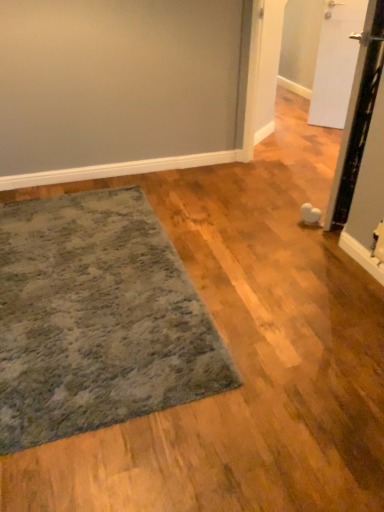
At what (x,y) coordinates should I click in order to perform the action: click on white matte door at upper right, placed as the 2th door when sorted from front to back. Please return your answer as a coordinate pair (x, y). This screenshot has height=512, width=384. Looking at the image, I should click on (336, 62).

Locate an element on the screen. This screenshot has height=512, width=384. white glossy door at right, acting as the first door starting from the front is located at coordinates (357, 116).

Would you say white glossy door at right, acting as the first door starting from the front, contains white matte door at upper right, acting as the first door starting from the back?

No, white matte door at upper right, acting as the first door starting from the back, is not inside white glossy door at right, acting as the first door starting from the front.

Which is closer to the camera, (351, 166) or (338, 31)?

Point (351, 166).

Considering the positions of objects white glossy door at right, the second door from the back, and white matte door at upper right, placed as the 2th door when sorted from front to back, in the image provided, who is more to the left, white glossy door at right, the second door from the back, or white matte door at upper right, placed as the 2th door when sorted from front to back,?

white glossy door at right, the second door from the back, is more to the left.

Which of these two, white glossy door at right, the second door from the back, or white matte door at upper right, placed as the 2th door when sorted from front to back, stands taller?

With more height is white glossy door at right, the second door from the back.

How many degrees apart are the facing directions of textured gray rug at lower left and white glossy door at right, the second door from the back?

133 degrees.

Considering the relative sizes of textured gray rug at lower left and white glossy door at right, the second door from the back, in the image provided, is textured gray rug at lower left thinner than white glossy door at right, the second door from the back,?

No, textured gray rug at lower left is not thinner than white glossy door at right, the second door from the back.

In the image, is textured gray rug at lower left on the left side or the right side of white glossy door at right, the second door from the back?

In the image, textured gray rug at lower left appears on the left side of white glossy door at right, the second door from the back.

At what (x,y) coordinates should I click in order to perform the action: click on the 2nd door located above the textured gray rug at lower left (from a real-world perspective). Please return your answer as a coordinate pair (x, y). This screenshot has height=512, width=384. Looking at the image, I should click on (357, 116).

Is there a large distance between textured gray rug at lower left and white matte door at upper right, placed as the 2th door when sorted from front to back?

textured gray rug at lower left is positioned a significant distance from white matte door at upper right, placed as the 2th door when sorted from front to back.

Can you tell me how much textured gray rug at lower left and white matte door at upper right, placed as the 2th door when sorted from front to back, differ in facing direction?

textured gray rug at lower left and white matte door at upper right, placed as the 2th door when sorted from front to back, are facing 43.9 degrees away from each other.

Who is bigger, textured gray rug at lower left or white matte door at upper right, placed as the 2th door when sorted from front to back?

Bigger between the two is textured gray rug at lower left.

Which point is more distant from viewer, [11,368] or [351,41]?

Point [351,41]

Is white matte door at upper right, placed as the 2th door when sorted from front to back, wider than textured gray rug at lower left?

Incorrect, the width of white matte door at upper right, placed as the 2th door when sorted from front to back, does not surpass that of textured gray rug at lower left.

From the picture: Is there a large distance between white matte door at upper right, acting as the first door starting from the back, and textured gray rug at lower left?

Yes, white matte door at upper right, acting as the first door starting from the back, and textured gray rug at lower left are located far from each other.

Measure the distance between white matte door at upper right, acting as the first door starting from the back, and textured gray rug at lower left.

white matte door at upper right, acting as the first door starting from the back, and textured gray rug at lower left are 8.79 feet apart from each other.

Based on the photo, which is more to the right, white matte door at upper right, placed as the 2th door when sorted from front to back, or textured gray rug at lower left?

white matte door at upper right, placed as the 2th door when sorted from front to back, is more to the right.

In the scene shown: Is white glossy door at right, acting as the first door starting from the front, bigger than textured gray rug at lower left?

No.

Is white glossy door at right, acting as the first door starting from the front, aimed at textured gray rug at lower left?

No.

Does white glossy door at right, the second door from the back, have a lesser height compared to textured gray rug at lower left?

In fact, white glossy door at right, the second door from the back, may be taller than textured gray rug at lower left.

Is white matte door at upper right, placed as the 2th door when sorted from front to back, at the left side of white glossy door at right, acting as the first door starting from the front?

No.

Which is correct: white matte door at upper right, placed as the 2th door when sorted from front to back, is inside white glossy door at right, acting as the first door starting from the front, or outside of it?

The correct answer is: outside.

Which is in front, point (335, 56) or point (337, 187)?

The point (337, 187) is in front.

The height and width of the screenshot is (512, 384). What are the coordinates of `door above the white glossy door at right, acting as the first door starting from the front (from the image's perspective)` in the screenshot? It's located at (336, 62).

From a real-world perspective, count 2nd doors upward from the textured gray rug at lower left and point to it. Please provide its 2D coordinates.

[(357, 116)]

Estimate the real-world distances between objects in this image. Which object is further from textured gray rug at lower left, white matte door at upper right, acting as the first door starting from the back, or white glossy door at right, acting as the first door starting from the front?

white matte door at upper right, acting as the first door starting from the back.

When comparing their distances from white matte door at upper right, placed as the 2th door when sorted from front to back, does white glossy door at right, acting as the first door starting from the front, or textured gray rug at lower left seem further?

textured gray rug at lower left lies further to white matte door at upper right, placed as the 2th door when sorted from front to back, than the other object.

Considering their positions, is textured gray rug at lower left positioned further to white glossy door at right, acting as the first door starting from the front, than white matte door at upper right, placed as the 2th door when sorted from front to back?

white matte door at upper right, placed as the 2th door when sorted from front to back, lies further to white glossy door at right, acting as the first door starting from the front, than the other object.

Based on their spatial positions, is white glossy door at right, the second door from the back, or white matte door at upper right, placed as the 2th door when sorted from front to back, further from textured gray rug at lower left?

Based on the image, white matte door at upper right, placed as the 2th door when sorted from front to back, appears to be further to textured gray rug at lower left.

In the scene shown: Considering their positions, is textured gray rug at lower left positioned further to white matte door at upper right, placed as the 2th door when sorted from front to back, than white glossy door at right, acting as the first door starting from the front?

The object further to white matte door at upper right, placed as the 2th door when sorted from front to back, is textured gray rug at lower left.

When comparing their distances from white glossy door at right, acting as the first door starting from the front, does white matte door at upper right, acting as the first door starting from the back, or textured gray rug at lower left seem closer?

textured gray rug at lower left is closer to white glossy door at right, acting as the first door starting from the front.

Locate an element on the screen. door located between textured gray rug at lower left and white matte door at upper right, acting as the first door starting from the back, in the depth direction is located at coordinates (357, 116).